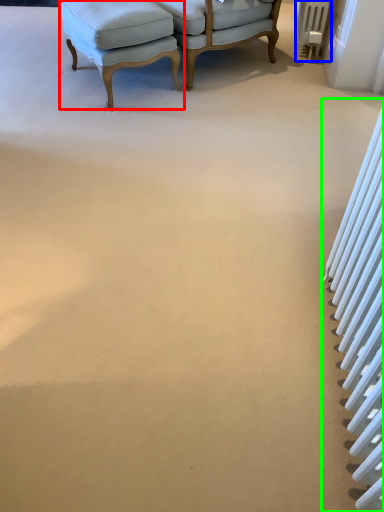
Question: Which is farther away from chair (highlighted by a red box)? radiator (highlighted by a blue box) or radiator (highlighted by a green box)?

Choices:
 (A) radiator
 (B) radiator

Answer: (B)